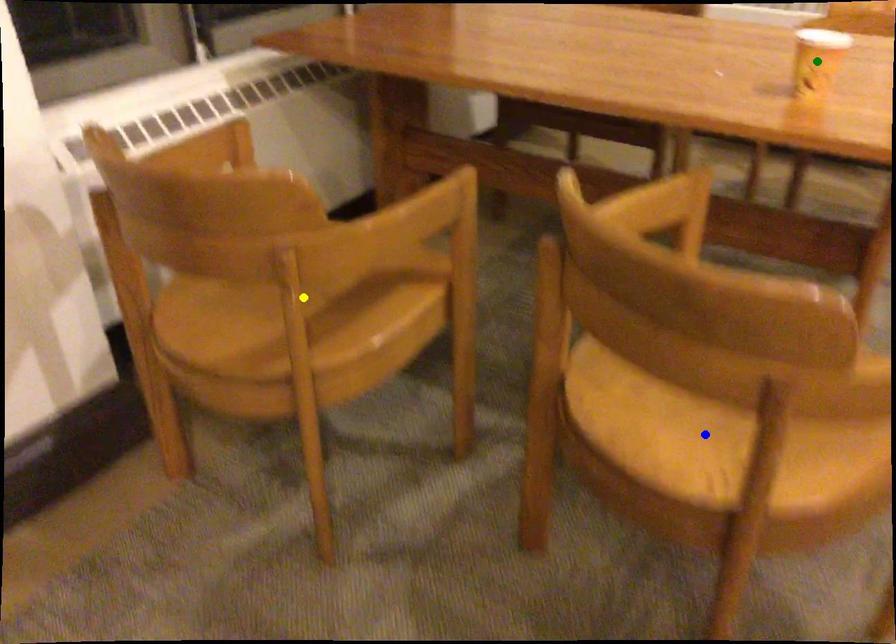
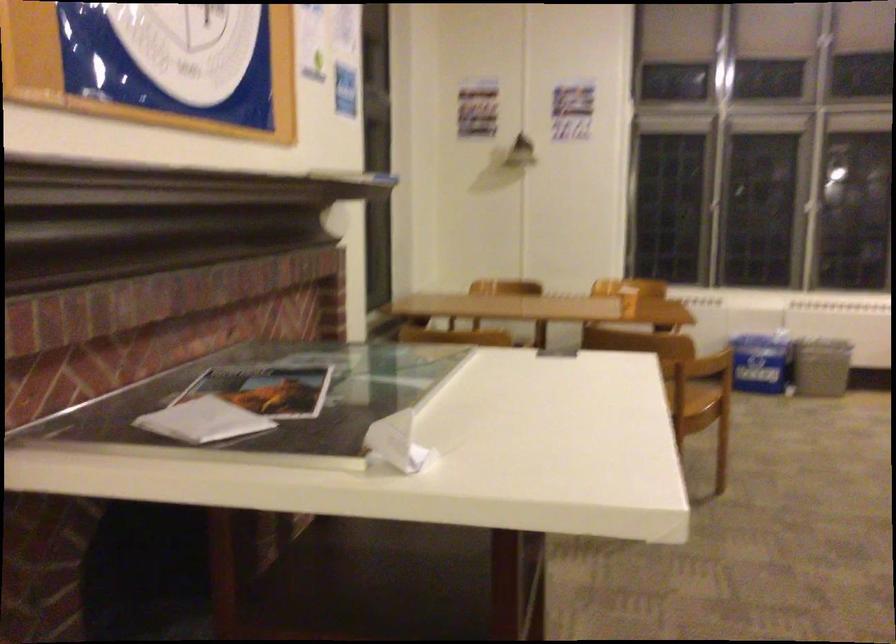
I am providing you with two images of the same scene from different viewpoints. Three points are marked in image1. Which point corresponds to a part or object that is occluded in image2?In image1, three points are marked. Which of them correspond to a part or object that is occluded in image2?Among the three points shown in image1, which one corresponds to a part or object that is no longer visible due to occlusion in image2?

yellow point, green point, blue point cannot be seen in image2.